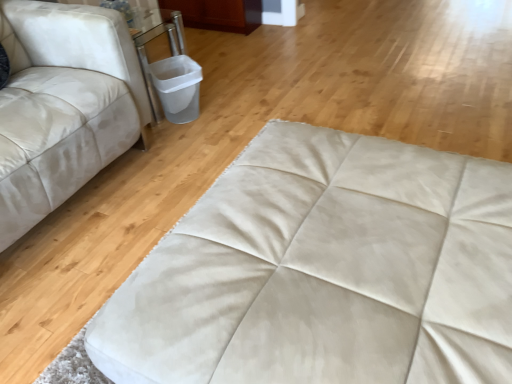
Describe the element at coordinates (61, 105) in the screenshot. I see `white leather studio couch at left` at that location.

You are a GUI agent. You are given a task and a screenshot of the screen. Output one action in this format:
    pyautogui.click(x=<x>, y=<y>)
    Task: Click on the white leather studio couch at left
    
    Given the screenshot: What is the action you would take?
    pyautogui.click(x=61, y=105)

Locate an element on the screen. The width and height of the screenshot is (512, 384). beige suede ottoman at center is located at coordinates (325, 271).

Describe the element at coordinates (325, 271) in the screenshot. I see `beige suede ottoman at center` at that location.

I want to click on white leather studio couch at left, so click(x=61, y=105).

Considering the positions of objects white leather studio couch at left and beige suede ottoman at center in the image provided, who is more to the right, white leather studio couch at left or beige suede ottoman at center?

beige suede ottoman at center is more to the right.

Is white leather studio couch at left positioned in front of beige suede ottoman at center?

No, it is behind beige suede ottoman at center.

Is point (6, 103) positioned in front of point (364, 285)?

No, it is not.

From the image's perspective, is white leather studio couch at left located above beige suede ottoman at center?

Indeed, from the image's perspective, white leather studio couch at left is shown above beige suede ottoman at center.

In the scene shown: From a real-world perspective, is white leather studio couch at left beneath beige suede ottoman at center?

Incorrect, from a real-world perspective, white leather studio couch at left is higher than beige suede ottoman at center.

Can you confirm if white leather studio couch at left is wider than beige suede ottoman at center?

In fact, white leather studio couch at left might be narrower than beige suede ottoman at center.

Is white leather studio couch at left shorter than beige suede ottoman at center?

No.

Between white leather studio couch at left and beige suede ottoman at center, which one has larger size?

white leather studio couch at left.

In the scene shown: Can beige suede ottoman at center be found inside white leather studio couch at left?

That's incorrect, beige suede ottoman at center is not inside white leather studio couch at left.

Is white leather studio couch at left not near beige suede ottoman at center?

Yes, white leather studio couch at left and beige suede ottoman at center are located far from each other.

Is white leather studio couch at left oriented towards beige suede ottoman at center?

Yes, white leather studio couch at left is oriented towards beige suede ottoman at center.

What's the angular difference between white leather studio couch at left and beige suede ottoman at center's facing directions?

The angle between the facing direction of white leather studio couch at left and the facing direction of beige suede ottoman at center is 88 degrees.

At what (x,y) coordinates should I click in order to perform the action: click on studio couch above the beige suede ottoman at center (from a real-world perspective). Please return your answer as a coordinate pair (x, y). Looking at the image, I should click on (61, 105).

Does beige suede ottoman at center appear on the right side of white leather studio couch at left?

Correct, you'll find beige suede ottoman at center to the right of white leather studio couch at left.

Relative to white leather studio couch at left, is beige suede ottoman at center in front or behind?

beige suede ottoman at center is positioned closer to the viewer than white leather studio couch at left.

Which point is more forward, (333, 155) or (136, 140)?

Positioned in front is point (333, 155).

From the image's perspective, does beige suede ottoman at center appear lower than white leather studio couch at left?

Yes, from the image's perspective, beige suede ottoman at center is beneath white leather studio couch at left.

From a real-world perspective, relative to white leather studio couch at left, is beige suede ottoman at center vertically above or below?

From a real-world perspective, beige suede ottoman at center is physically below white leather studio couch at left.

Considering the sizes of objects beige suede ottoman at center and white leather studio couch at left in the image provided, who is thinner, beige suede ottoman at center or white leather studio couch at left?

white leather studio couch at left is thinner.

Which of these two, beige suede ottoman at center or white leather studio couch at left, stands taller?

white leather studio couch at left is taller.

Considering the relative sizes of beige suede ottoman at center and white leather studio couch at left in the image provided, is beige suede ottoman at center bigger than white leather studio couch at left?

No.

Is white leather studio couch at left inside beige suede ottoman at center?

No, beige suede ottoman at center does not contain white leather studio couch at left.

Are beige suede ottoman at center and white leather studio couch at left making contact?

No, beige suede ottoman at center is not next to white leather studio couch at left.

Is beige suede ottoman at center positioned with its back to white leather studio couch at left?

No, white leather studio couch at left is not at the back of beige suede ottoman at center.

Measure the distance from beige suede ottoman at center to white leather studio couch at left.

3.58 feet.

I want to click on furniture that is in front of the white leather studio couch at left, so click(325, 271).

Locate an element on the screen. This screenshot has height=384, width=512. furniture below the white leather studio couch at left (from the image's perspective) is located at coordinates (325, 271).

Identify the location of studio couch to the left of beige suede ottoman at center. The width and height of the screenshot is (512, 384). (61, 105).